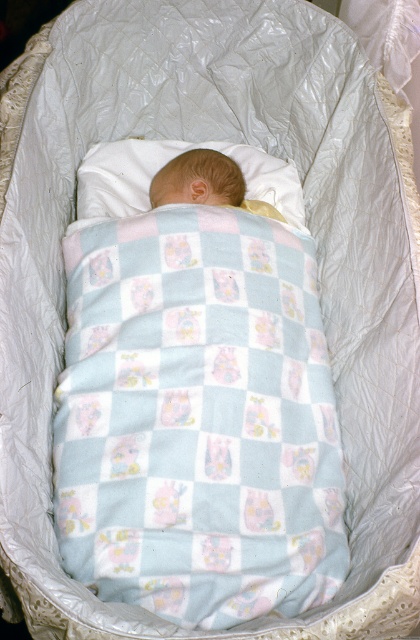
From the picture: You are a nurse in a hospital nursery. You need to place a newborn in the bassinet. The bassinet has a white soft pillow at center and a light blue soft fabric newborn at center. Which object should you place the newborn on to ensure comfort and safety?

You should place the newborn on the white soft pillow at center because it is bigger than the light blue soft fabric newborn at center, providing more support and space for the baby.

You are a new parent checking on your baby in the bassinet. You notice the light blue flannel blanket at center and the white soft pillow at center. Which item is bigger in size?

The light blue flannel blanket at center has a larger size compared to the white soft pillow at center.